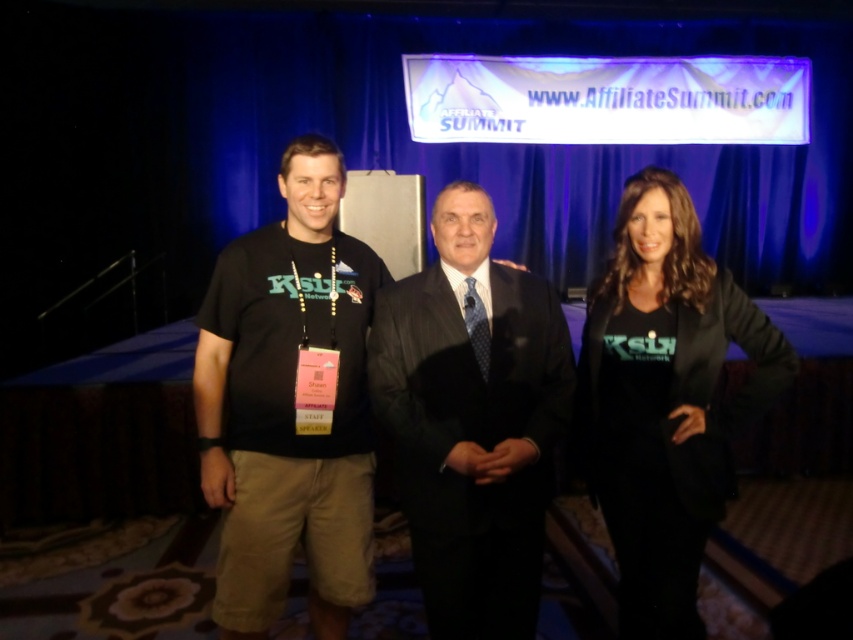
Question: Is dark suit at center to the right of black matte jacket at center from the viewer's perspective?

Choices:
 (A) yes
 (B) no

Answer: (B)

Question: Is black cotton t-shirt at left behind dark suit at center?

Choices:
 (A) no
 (B) yes

Answer: (B)

Question: Estimate the real-world distances between objects in this image. Which object is farther from the black cotton t-shirt at left?

Choices:
 (A) black matte jacket at center
 (B) dark suit at center

Answer: (A)

Question: Which object appears farthest from the camera in this image?

Choices:
 (A) black cotton t-shirt at left
 (B) dark suit at center
 (C) black matte jacket at center

Answer: (A)

Question: Considering the real-world distances, which object is closest to the black matte jacket at center?

Choices:
 (A) black cotton t-shirt at left
 (B) dark suit at center

Answer: (B)

Question: Is black cotton t-shirt at left thinner than black matte jacket at center?

Choices:
 (A) yes
 (B) no

Answer: (B)